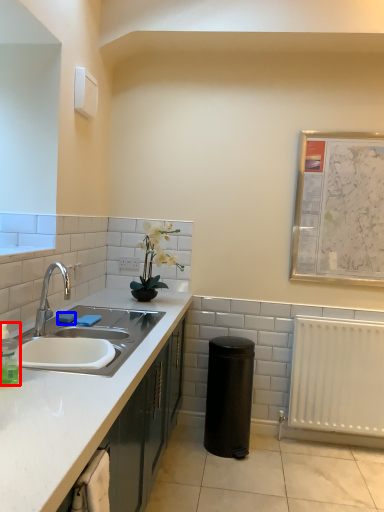
Question: Which object is closer to the camera taking this photo, bottle (highlighted by a red box) or soap (highlighted by a blue box)?

Choices:
 (A) bottle
 (B) soap

Answer: (A)